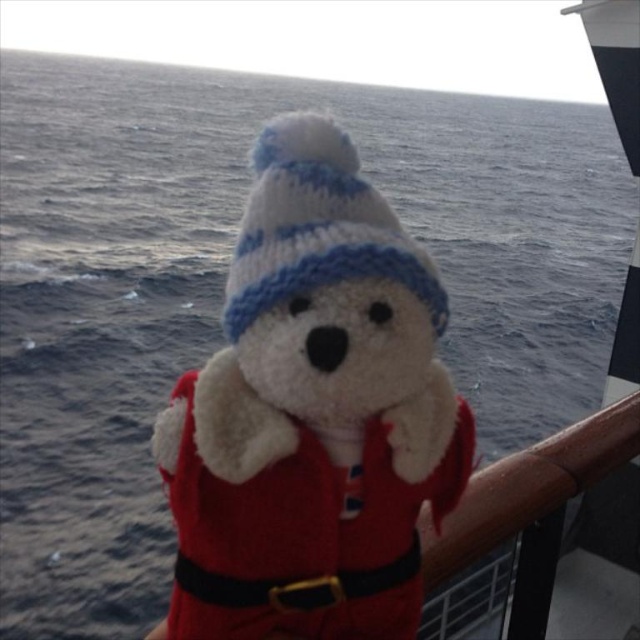
Between white plush santa claus at center and white knitted hat at center, which one is positioned higher?

white knitted hat at center is higher up.

Can you confirm if white plush santa claus at center is taller than white knitted hat at center?

Yes, white plush santa claus at center is taller than white knitted hat at center.

Identify the location of white plush santa claus at center. This screenshot has height=640, width=640. (314, 413).